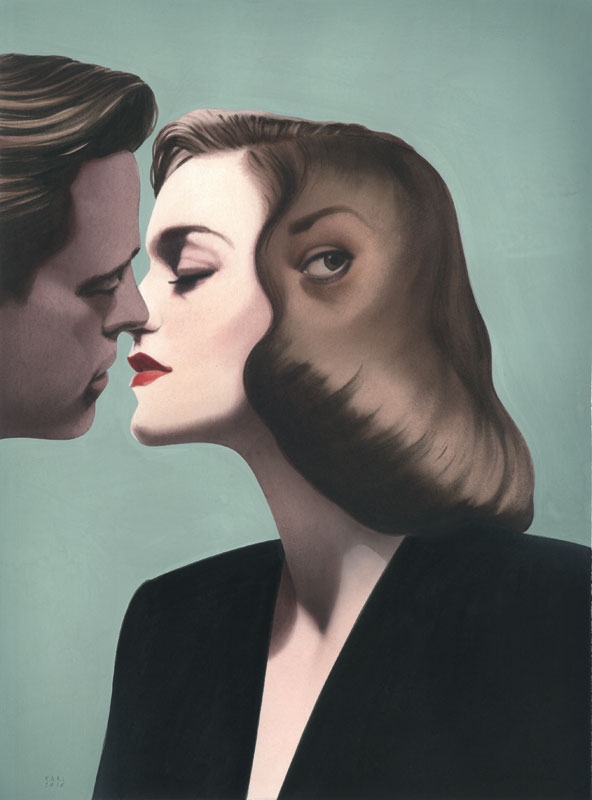
At what (x,y) coordinates should I click in order to perform the action: click on chest. Please return your answer as a coordinate pair (x, y). Looking at the image, I should click on (287, 685).